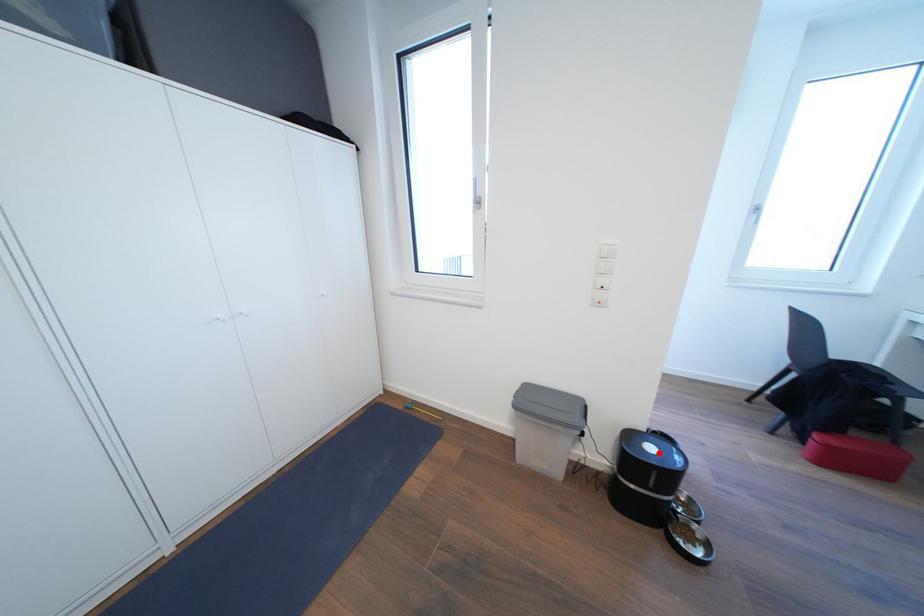
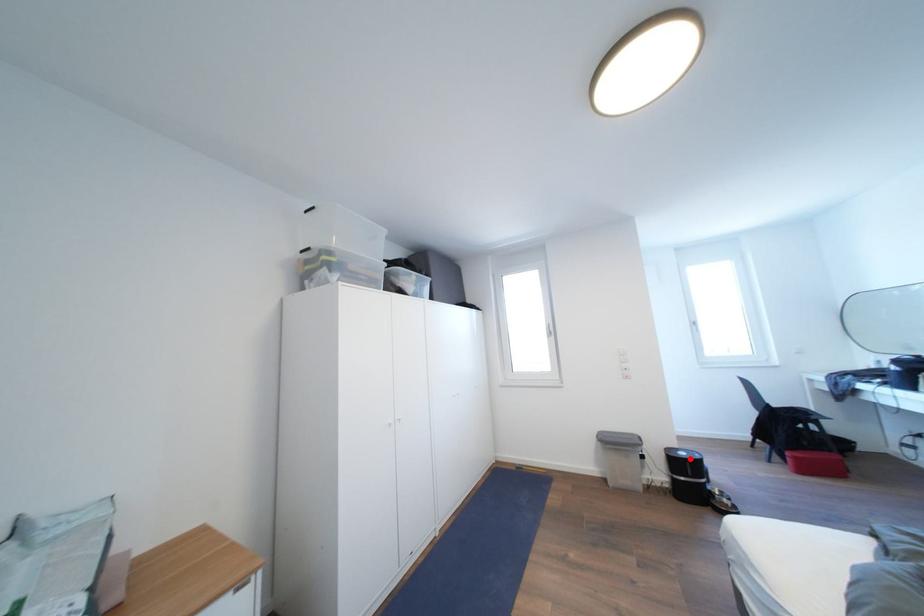
I am providing you with two images of the same scene from different viewpoints. A red point is marked on the first image and another point is marked on the second image. Is the marked point in image1 the same physical position as the marked point in image2?

Yes